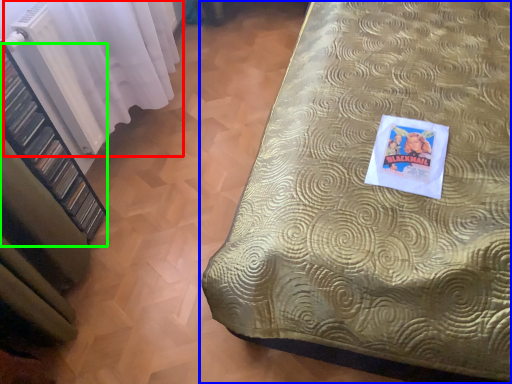
Question: Which object is positioned closest to curtain (highlighted by a red box)? Select from bed (highlighted by a blue box) and shelf (highlighted by a green box).

Choices:
 (A) bed
 (B) shelf

Answer: (B)